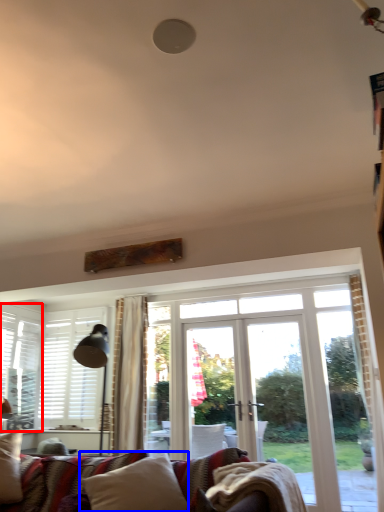
Question: Among these objects, which one is farthest to the camera, window (highlighted by a red box) or pillow (highlighted by a blue box)?

Choices:
 (A) window
 (B) pillow

Answer: (A)